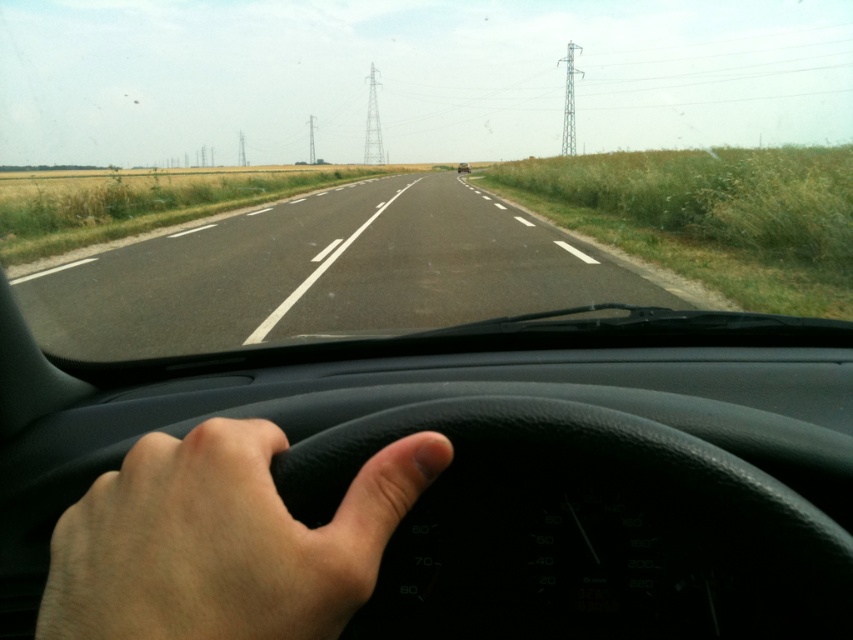
Question: Does transparent glass windshield at center appear on the left side of metallic silver car at center?

Choices:
 (A) yes
 (B) no

Answer: (A)

Question: Which is nearer to the metallic silver car at center?

Choices:
 (A) transparent glass windshield at center
 (B) light skin/soft touch hand at center
 (C) asphalt road at center

Answer: (A)

Question: Which of the following is the closest to the observer?

Choices:
 (A) (308, 536)
 (B) (459, 163)

Answer: (A)

Question: Does asphalt road at center have a smaller size compared to light skin/soft touch hand at center?

Choices:
 (A) yes
 (B) no

Answer: (B)

Question: Is light skin/soft touch hand at center positioned in front of metallic silver car at center?

Choices:
 (A) yes
 (B) no

Answer: (A)

Question: Among these objects, which one is farthest from the camera?

Choices:
 (A) transparent glass windshield at center
 (B) light skin/soft touch hand at center
 (C) asphalt road at center

Answer: (A)